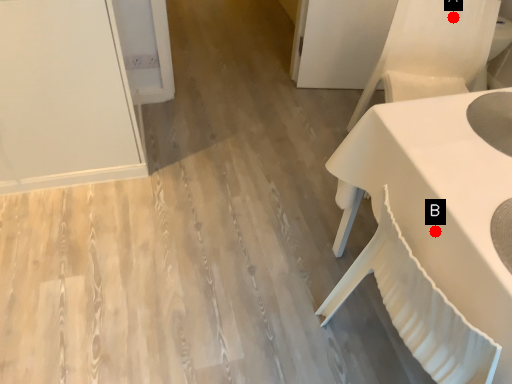
Question: Two points are circled on the image, labeled by A and B beside each circle. Among these points, which one is nearest to the camera?

Choices:
 (A) A is closer
 (B) B is closer

Answer: (B)